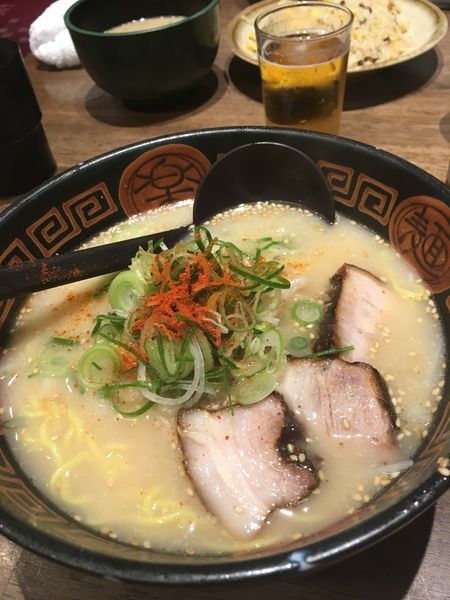
Where is `black cup`? black cup is located at coordinates (33, 132).